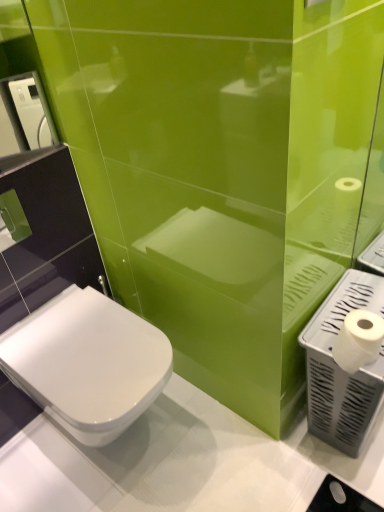
Where is `free space above white glossy toilet at lower left (from a real-world perspective)`? This screenshot has width=384, height=512. free space above white glossy toilet at lower left (from a real-world perspective) is located at coordinates (87, 346).